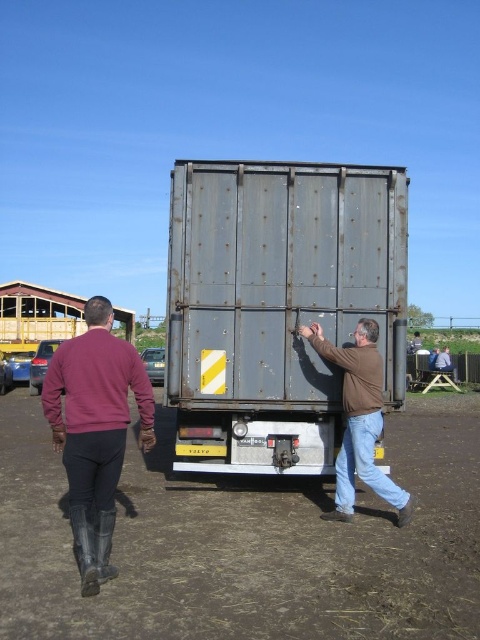
Question: Which of these objects is positioned closest to the dark red sweater at left?

Choices:
 (A) rusty metal trailer truck at center
 (B) brown dirt field at center
 (C) brown matte jacket at center

Answer: (C)

Question: Is brown dirt field at center below brown matte jacket at center?

Choices:
 (A) no
 (B) yes

Answer: (B)

Question: Is the position of brown dirt field at center more distant than that of dark red sweater at left?

Choices:
 (A) no
 (B) yes

Answer: (A)

Question: Among these objects, which one is farthest from the camera?

Choices:
 (A) dark red sweater at left
 (B) brown matte jacket at center
 (C) rusty metal trailer truck at center

Answer: (C)

Question: Which of the following is the farthest from the observer?

Choices:
 (A) brown matte jacket at center
 (B) rusty metal trailer truck at center
 (C) dark red sweater at left
 (D) brown dirt field at center

Answer: (B)

Question: Does brown dirt field at center lie behind brown matte jacket at center?

Choices:
 (A) yes
 (B) no

Answer: (B)